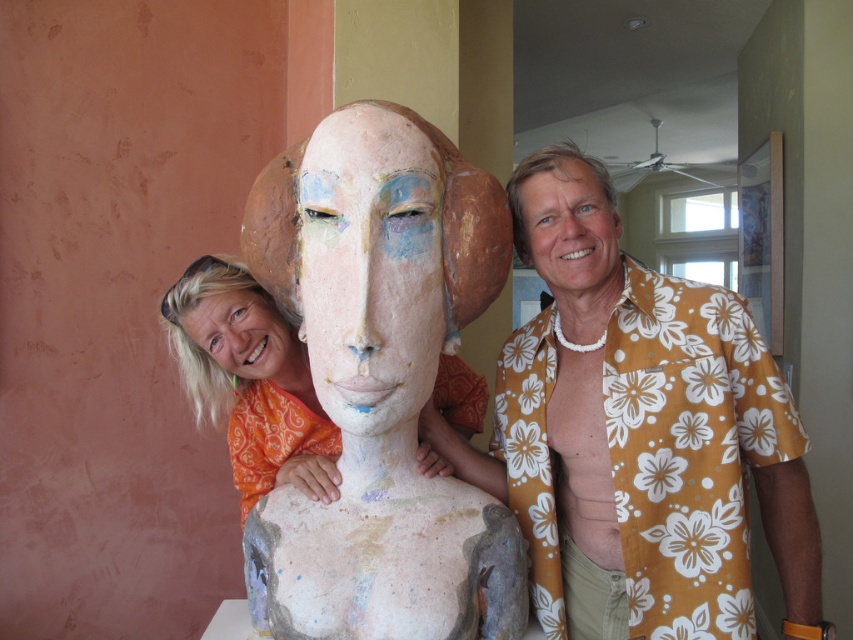
Question: Does orange floral shirt at center appear on the left side of yellow floral shirt at right?

Choices:
 (A) yes
 (B) no

Answer: (A)

Question: Which of the following is the farthest from the observer?

Choices:
 (A) yellow floral shirt at right
 (B) matte yellow floral shirt at right
 (C) matte clay mask at center
 (D) matte clay head at center

Answer: (D)

Question: Is orange floral shirt at center further to the viewer compared to matte clay mask at center?

Choices:
 (A) yes
 (B) no

Answer: (A)

Question: Is matte clay bust at center to the left of orange fabric at left from the viewer's perspective?

Choices:
 (A) yes
 (B) no

Answer: (B)

Question: Which point appears closest to the camera in this image?

Choices:
 (A) (234, 272)
 (B) (561, 168)

Answer: (B)

Question: Which of the following is the closest to the observer?

Choices:
 (A) (468, 493)
 (B) (534, 541)
 (C) (341, 188)

Answer: (C)